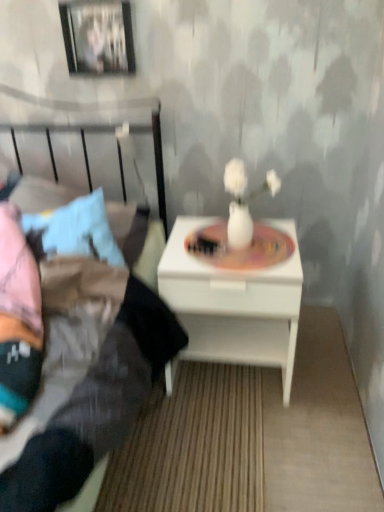
Question: Is point (6, 504) closer or farther from the camera than point (279, 284)?

Choices:
 (A) farther
 (B) closer

Answer: (B)

Question: Is matte black bed at left taller or shorter than white glossy nightstand at center?

Choices:
 (A) tall
 (B) short

Answer: (A)

Question: Which object is positioned farthest from the metallic silver picture frame at upper left?

Choices:
 (A) white glossy nightstand at center
 (B) matte white vase at center
 (C) matte black bed at left

Answer: (A)

Question: Which object is the farthest from the white glossy nightstand at center?

Choices:
 (A) matte white vase at center
 (B) metallic silver picture frame at upper left
 (C) matte black bed at left

Answer: (B)